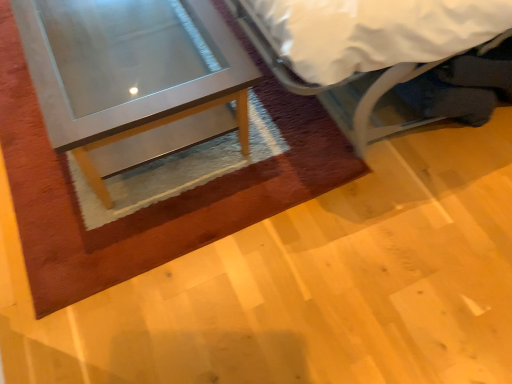
Question: From a real-world perspective, does white fabric bed at upper right stand above matte glass table at left?

Choices:
 (A) no
 (B) yes

Answer: (B)

Question: From a real-world perspective, is white fabric bed at upper right positioned under matte glass table at left based on gravity?

Choices:
 (A) no
 (B) yes

Answer: (A)

Question: Does white fabric bed at upper right have a greater width compared to matte glass table at left?

Choices:
 (A) no
 (B) yes

Answer: (B)

Question: Is white fabric bed at upper right aimed at matte glass table at left?

Choices:
 (A) no
 (B) yes

Answer: (B)

Question: Is white fabric bed at upper right at the left side of matte glass table at left?

Choices:
 (A) no
 (B) yes

Answer: (A)

Question: Is matte glass table at left completely or partially inside white fabric bed at upper right?

Choices:
 (A) no
 (B) yes

Answer: (A)

Question: Is matte glass table at left shorter than white fabric bed at upper right?

Choices:
 (A) yes
 (B) no

Answer: (A)

Question: From the image's perspective, is matte glass table at left under white fabric bed at upper right?

Choices:
 (A) yes
 (B) no

Answer: (A)

Question: Does matte glass table at left have a lesser width compared to white fabric bed at upper right?

Choices:
 (A) no
 (B) yes

Answer: (B)

Question: Can white fabric bed at upper right be found inside matte glass table at left?

Choices:
 (A) no
 (B) yes

Answer: (A)

Question: From the image's perspective, is matte glass table at left on top of white fabric bed at upper right?

Choices:
 (A) no
 (B) yes

Answer: (A)

Question: From a real-world perspective, is matte glass table at left beneath white fabric bed at upper right?

Choices:
 (A) yes
 (B) no

Answer: (A)

Question: From their relative heights in the image, would you say white fabric bed at upper right is taller or shorter than matte glass table at left?

Choices:
 (A) short
 (B) tall

Answer: (B)